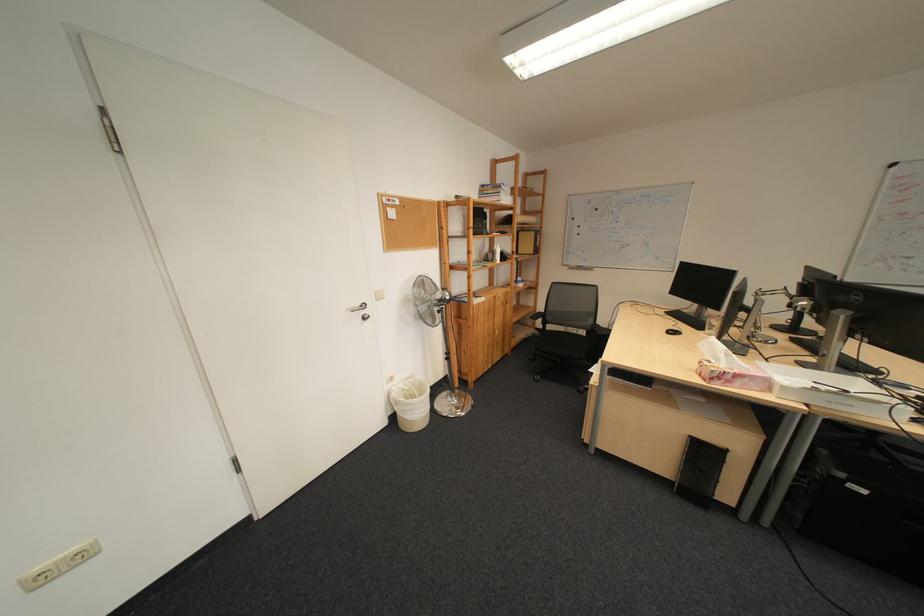
Locate an element on the screen. fan control knob is located at coordinates (421, 299).